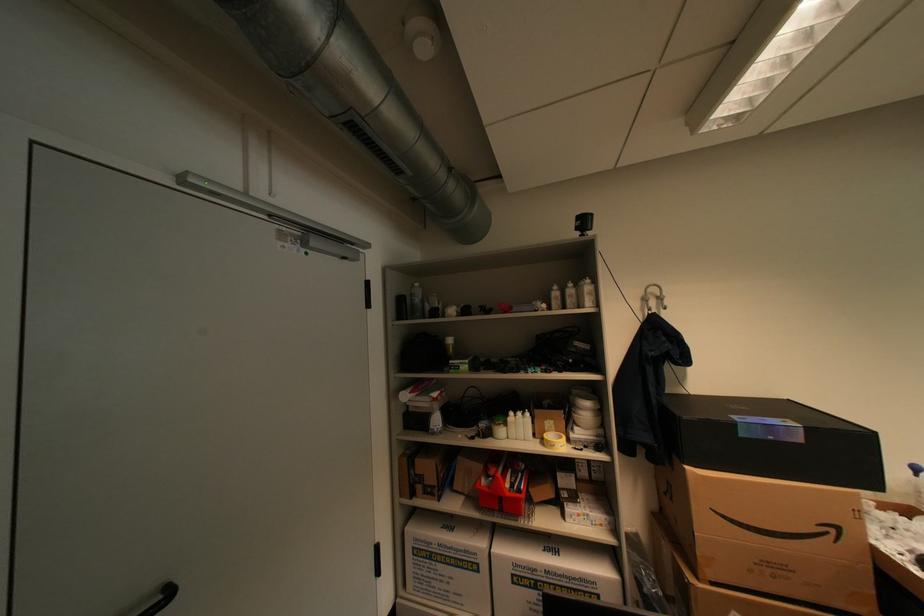
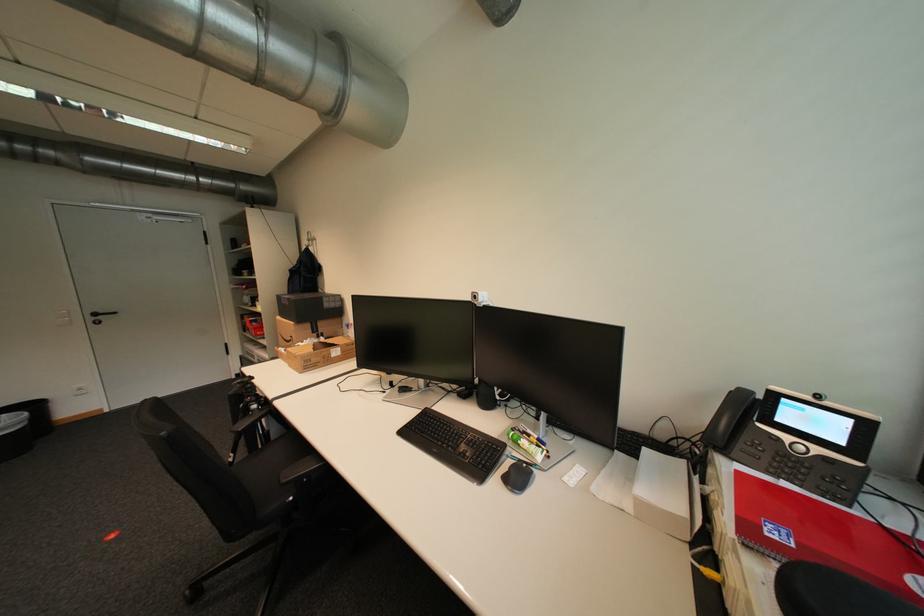
Question: Which direction would the cameraman need to move to produce the second image? Reply with the corresponding letter.

Choices:
 (A) Left
 (B) Right
 (C) Forward
 (D) Backward

Answer: (B)